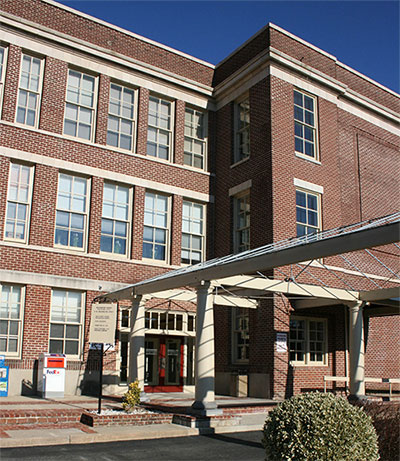
Find the location of `trash can`. trash can is located at coordinates (240, 387).